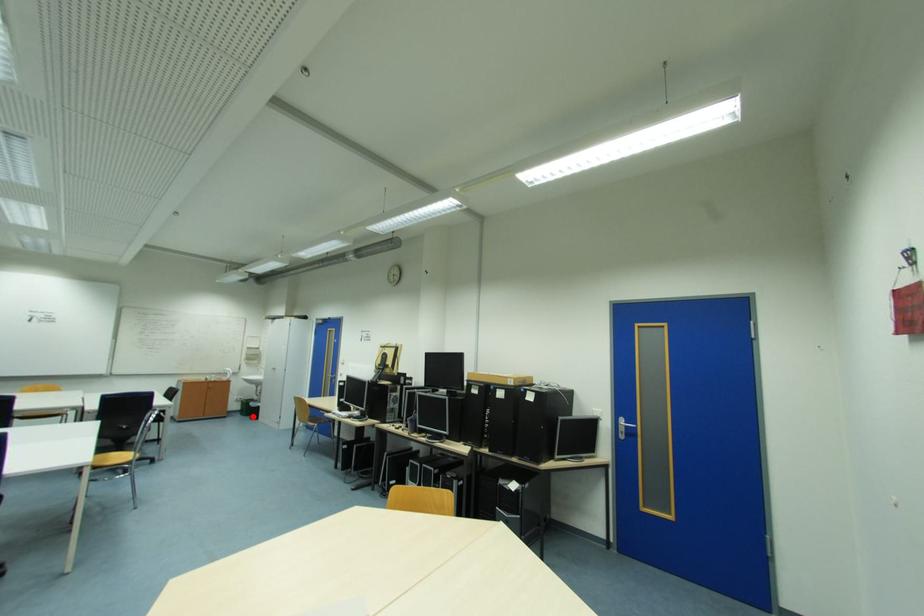
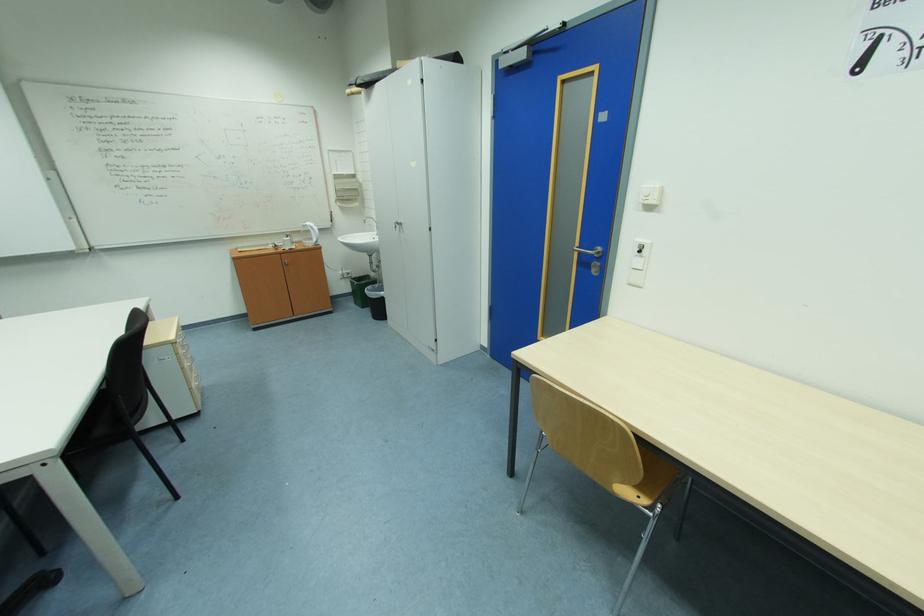
Question: I am providing you with two images of the same scene from different viewpoints. Image1 has a red point marked. In image2, the corresponding 3D location appears at what relative position? Reply with the corresponding letter.

Choices:
 (A) Closer
 (B) Farther

Answer: (A)